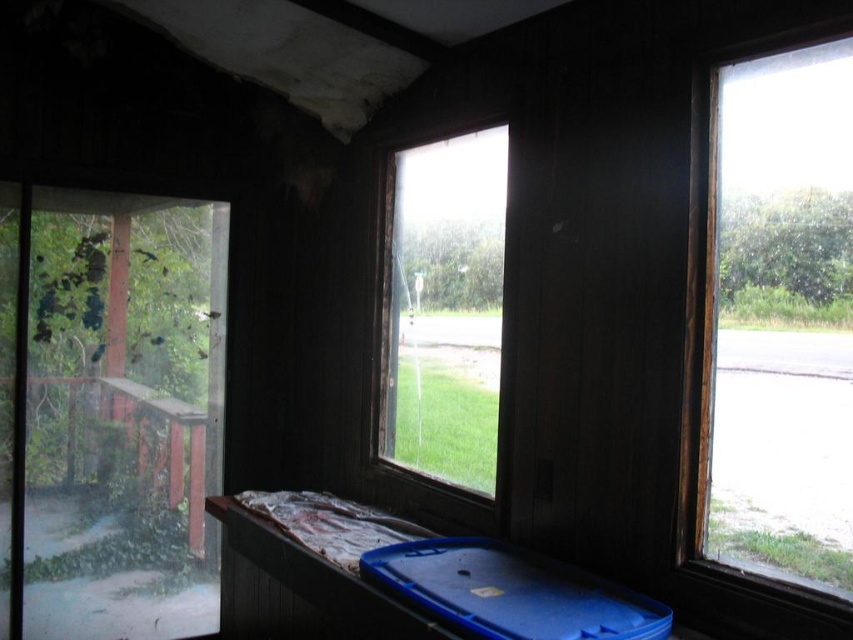
You are standing in the room and want to see the view outside the clear glass window at right and the clear glass window at center. Which window allows you to see further into the distance?

The clear glass window at right is in front of the clear glass window at center, so you can see further into the distance through the clear glass window at right.

You are a window cleaner assessing the job. You need to clean the clear glass window at right and the clear glass window at center. Which window requires a taller ladder to reach its top?

The clear glass window at center requires a taller ladder because it is taller than the clear glass window at right.